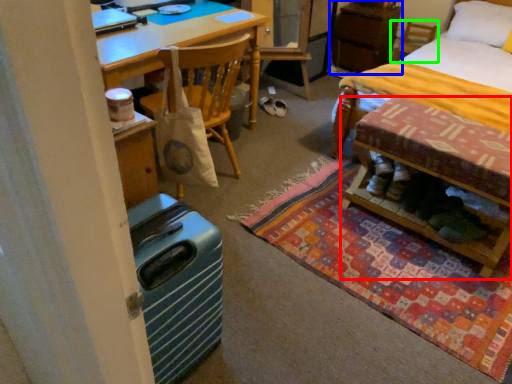
Question: Based on their relative distances, which object is nearer to table (highlighted by a red box)? Choose from cabinetry (highlighted by a blue box) and chair (highlighted by a green box).

Choices:
 (A) cabinetry
 (B) chair

Answer: (A)